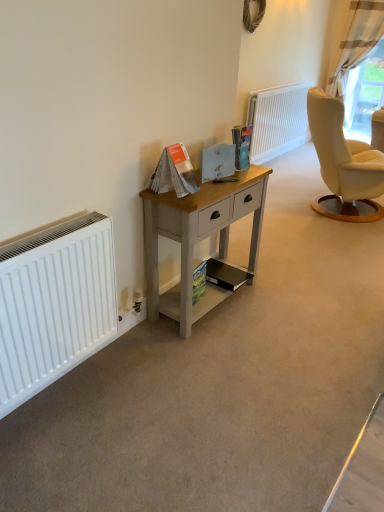
Question: Is matte paper magazine at center, the 5th magazine when ordered from bottom to top, thinner than matte blue card at center, which is counted as the 4th magazine, starting from the bottom?

Choices:
 (A) no
 (B) yes

Answer: (A)

Question: Is matte paper magazine at center, which is the first magazine from top to bottom, wider than matte blue card at center, which is counted as the second magazine, starting from the top?

Choices:
 (A) yes
 (B) no

Answer: (A)

Question: Are matte paper magazine at center, the 5th magazine when ordered from bottom to top, and matte blue card at center, which is counted as the 4th magazine, starting from the bottom, located far from each other?

Choices:
 (A) no
 (B) yes

Answer: (A)

Question: From a real-world perspective, is matte paper magazine at center, which is the first magazine from top to bottom, physically above matte blue card at center, which is counted as the 4th magazine, starting from the bottom?

Choices:
 (A) yes
 (B) no

Answer: (A)

Question: Is matte paper magazine at center, which is the first magazine from top to bottom, oriented towards matte blue card at center, which is counted as the second magazine, starting from the top?

Choices:
 (A) yes
 (B) no

Answer: (B)

Question: Does matte paper magazine at center, which is the first magazine from top to bottom, appear on the left side of matte blue card at center, which is counted as the second magazine, starting from the top?

Choices:
 (A) yes
 (B) no

Answer: (B)

Question: Considering the relative sizes of transparent glass window at upper right and matte paper magazine at center, which is the first magazine from top to bottom, in the image provided, is transparent glass window at upper right taller than matte paper magazine at center, which is the first magazine from top to bottom,?

Choices:
 (A) yes
 (B) no

Answer: (A)

Question: Does transparent glass window at upper right have a greater width compared to matte paper magazine at center, which is the first magazine from top to bottom?

Choices:
 (A) no
 (B) yes

Answer: (B)

Question: Is transparent glass window at upper right surrounding matte paper magazine at center, the 5th magazine when ordered from bottom to top?

Choices:
 (A) yes
 (B) no

Answer: (B)

Question: Does transparent glass window at upper right appear on the right side of matte paper magazine at center, which is the first magazine from top to bottom?

Choices:
 (A) yes
 (B) no

Answer: (A)

Question: Considering the relative sizes of transparent glass window at upper right and matte paper magazine at center, the 5th magazine when ordered from bottom to top, in the image provided, is transparent glass window at upper right bigger than matte paper magazine at center, the 5th magazine when ordered from bottom to top,?

Choices:
 (A) no
 (B) yes

Answer: (B)

Question: From the image's perspective, is transparent glass window at upper right below matte paper magazine at center, which is the first magazine from top to bottom?

Choices:
 (A) yes
 (B) no

Answer: (B)

Question: Does white matte radiator at upper center, which is counted as the first radiator, starting from the back, appear on the right side of white textured curtain at upper right?

Choices:
 (A) yes
 (B) no

Answer: (B)